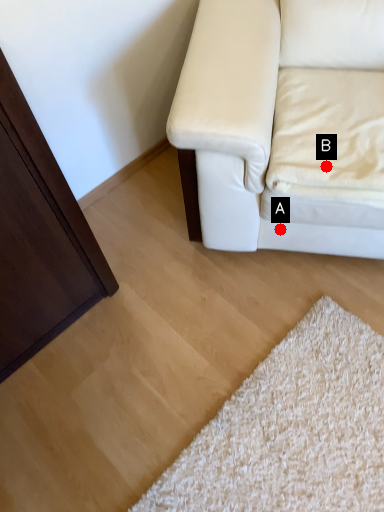
Question: Two points are circled on the image, labeled by A and B beside each circle. Which point appears closest to the camera in this image?

Choices:
 (A) A is closer
 (B) B is closer

Answer: (B)